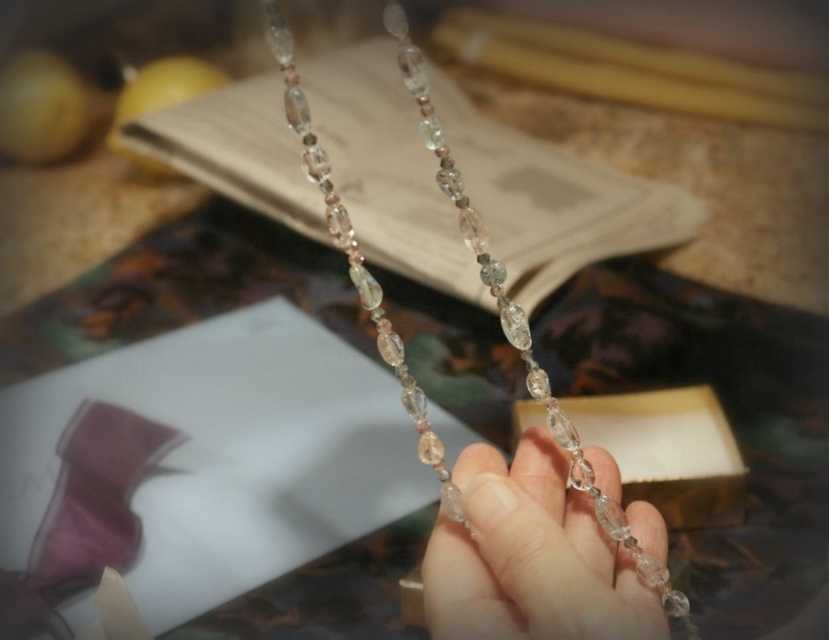
You are a jeweler examining the clear crystal beads at center and the clear crystal necklace at center. Which object takes up more space in the image?

The clear crystal necklace at center takes up more space than the clear crystal beads at center.

You are a jeweler examining the clear crystal beads at center and the clear crystal necklace at center. Which object is positioned closer to your eyes?

The clear crystal beads at center are closer to the viewer than the clear crystal necklace at center.

You are a jeweler examining the necklace in the image. The clear crystal beads at center are positioned at coordinates 0.870, 0.641. If you want to place them exactly at the center of the image, which direction should you move them?

The clear crystal beads at center are currently located at coordinates (531, 556). To move them to the exact center of the image, you would need to move them slightly to the left and upward since the current coordinates are to the right and below the true center point.